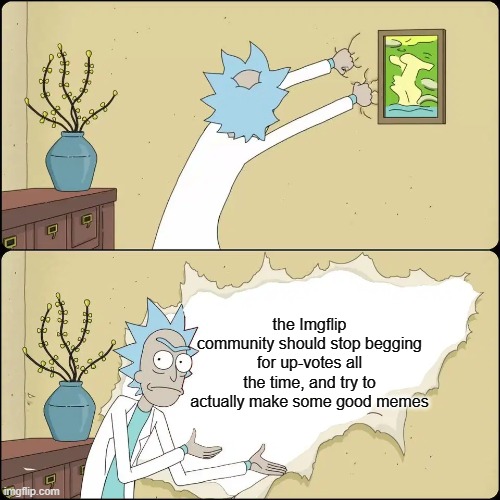
I want to click on upper screen yellow wall, so click(357, 159).